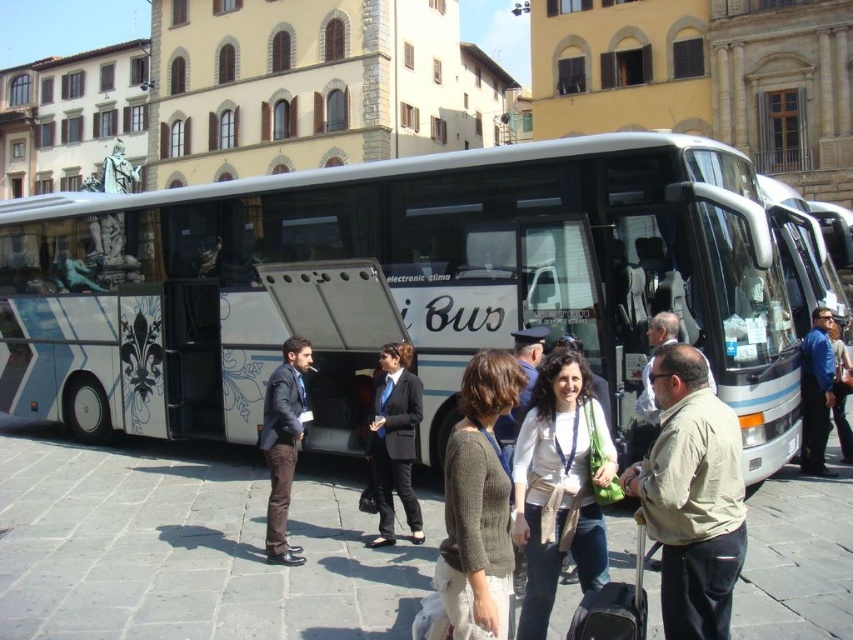
Can you confirm if dark gray suit at center is positioned below blue denim jacket at center?

Yes, dark gray suit at center is below blue denim jacket at center.

Which is more to the left, dark gray suit at center or blue denim jacket at center?

Positioned to the left is dark gray suit at center.

Is point (302, 557) less distant than point (808, 445)?

Yes, point (302, 557) is in front of point (808, 445).

Identify the location of dark gray suit at center. This screenshot has width=853, height=640. (283, 444).

Looking at this image, is beige fabric shirt at center taller than dark gray suit at center?

Correct, beige fabric shirt at center is much taller as dark gray suit at center.

Who is positioned more to the right, beige fabric shirt at center or dark gray suit at center?

beige fabric shirt at center

Is point (697, 477) positioned in front of point (277, 460)?

Yes, point (697, 477) is in front of point (277, 460).

Where is `beige fabric shirt at center`? The height and width of the screenshot is (640, 853). beige fabric shirt at center is located at coordinates (692, 497).

Can you confirm if metallic silver bus stop at center is bigger than black suit at center?

Correct, metallic silver bus stop at center is larger in size than black suit at center.

Is metallic silver bus stop at center shorter than black suit at center?

Yes.

Is point (346, 332) farther from camera compared to point (384, 440)?

Yes, point (346, 332) is behind point (384, 440).

What are the coordinates of `metallic silver bus stop at center` in the screenshot? It's located at (335, 301).